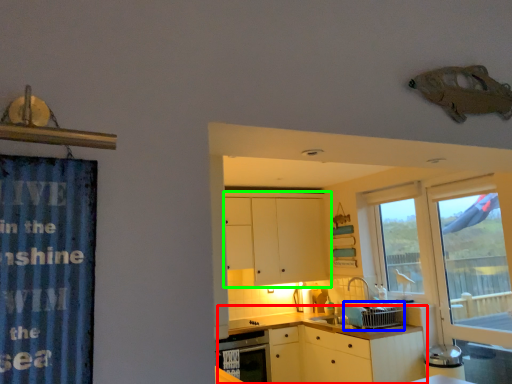
Question: Based on their relative distances, which object is farther from counter top (highlighted by a red box)? Choose from appliance (highlighted by a blue box) and cabinetry (highlighted by a green box).

Choices:
 (A) appliance
 (B) cabinetry

Answer: (B)